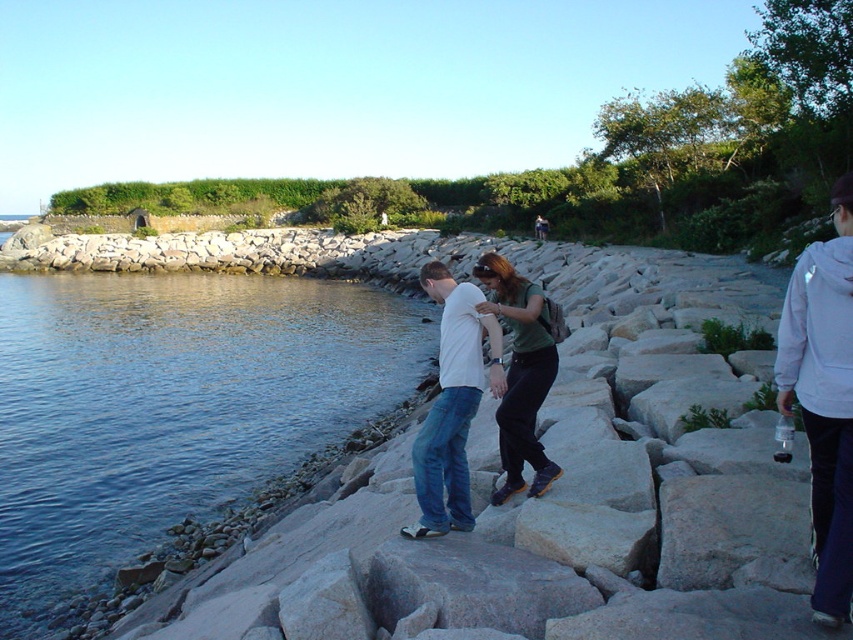
What do you see at coordinates (822, 397) in the screenshot? The image size is (853, 640). I see `white fleece jacket at right` at bounding box center [822, 397].

Who is more forward, (850, 492) or (527, 422)?

Point (850, 492) is more forward.

Where is `white fleece jacket at right`? This screenshot has height=640, width=853. white fleece jacket at right is located at coordinates click(x=822, y=397).

Does white fleece jacket at right have a greater height compared to green fabric shirt at center?

In fact, white fleece jacket at right may be shorter than green fabric shirt at center.

Between white fleece jacket at right and green fabric shirt at center, which one is positioned lower?

white fleece jacket at right is lower down.

Between point (842, 593) and point (498, 417), which one is positioned behind?

Positioned behind is point (498, 417).

Locate an element on the screen. The width and height of the screenshot is (853, 640). white fleece jacket at right is located at coordinates pos(822,397).

Between blue water at lower left and white fleece jacket at right, which one appears on the left side from the viewer's perspective?

Positioned to the left is blue water at lower left.

Is point (19, 572) positioned after point (828, 273)?

Yes.

This screenshot has height=640, width=853. What do you see at coordinates (169, 406) in the screenshot?
I see `blue water at lower left` at bounding box center [169, 406].

At what (x,y) coordinates should I click in order to perform the action: click on blue water at lower left. Please return your answer as a coordinate pair (x, y). Looking at the image, I should click on (169, 406).